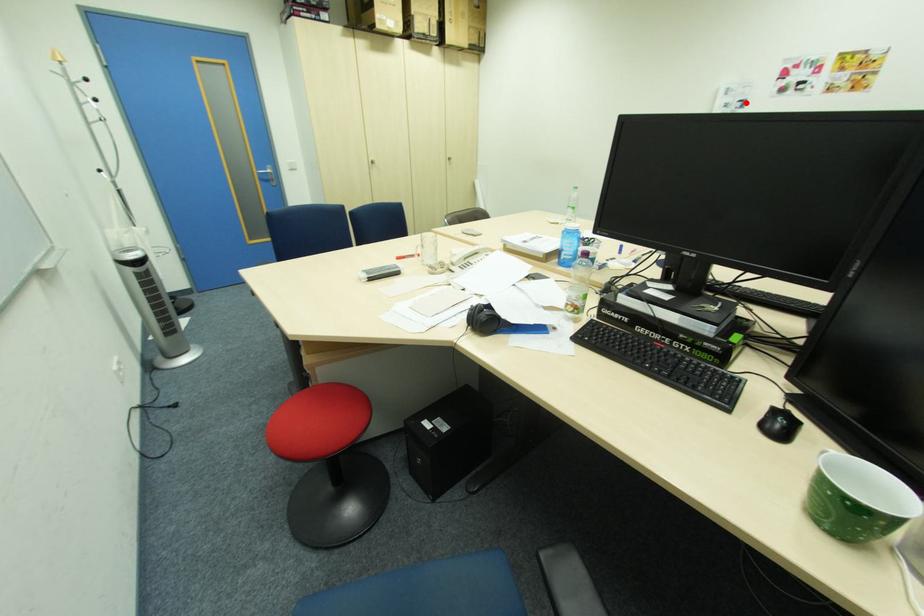
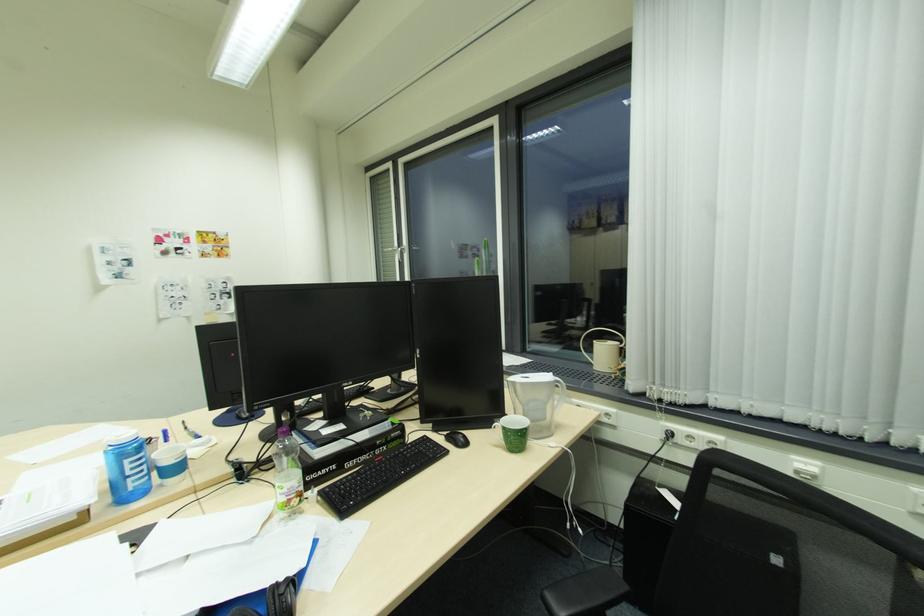
In the second image, find the point that corresponds to the highlighted location in the first image.

(131, 262)